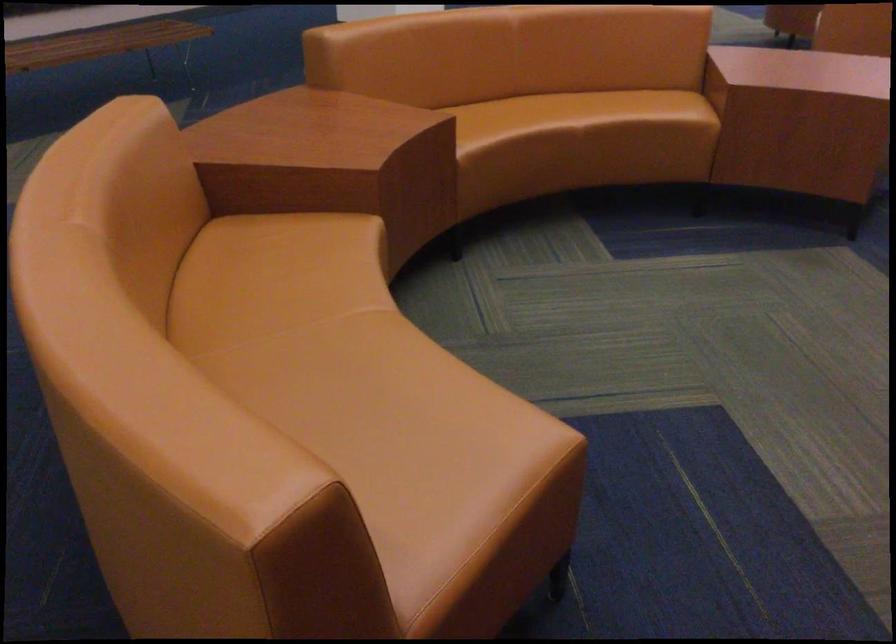
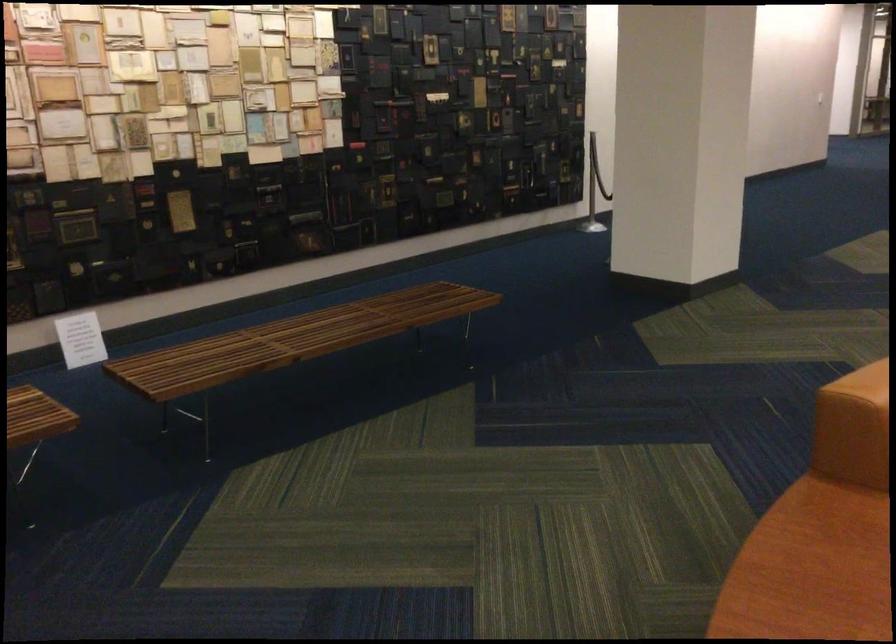
Where in the second image is the point corresponding to the point at 264,120 from the first image?

(811, 569)